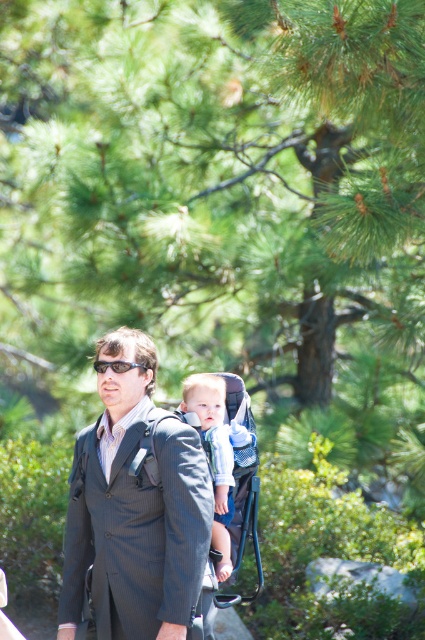
Describe the element at coordinates (135, 509) in the screenshot. This screenshot has width=425, height=640. I see `dark gray suit at center` at that location.

Who is lower down, dark gray suit at center or light blue denim shirt at center?

light blue denim shirt at center

In order to click on dark gray suit at center in this screenshot , I will do `click(135, 509)`.

What are the coordinates of `dark gray suit at center` in the screenshot? It's located at (135, 509).

Between light blue denim shirt at center and black plastic sunglasses at center, which one is positioned lower?

Positioned lower is light blue denim shirt at center.

Is light blue denim shirt at center further to camera compared to black plastic sunglasses at center?

Yes.

Image resolution: width=425 pixels, height=640 pixels. What do you see at coordinates (217, 454) in the screenshot?
I see `light blue denim shirt at center` at bounding box center [217, 454].

This screenshot has height=640, width=425. Find the location of `light blue denim shirt at center`. light blue denim shirt at center is located at coordinates (217, 454).

Can you confirm if dark gray suit at center is shorter than black plastic sunglasses at center?

No, dark gray suit at center is not shorter than black plastic sunglasses at center.

Is dark gray suit at center below black plastic sunglasses at center?

Yes.

I want to click on dark gray suit at center, so click(135, 509).